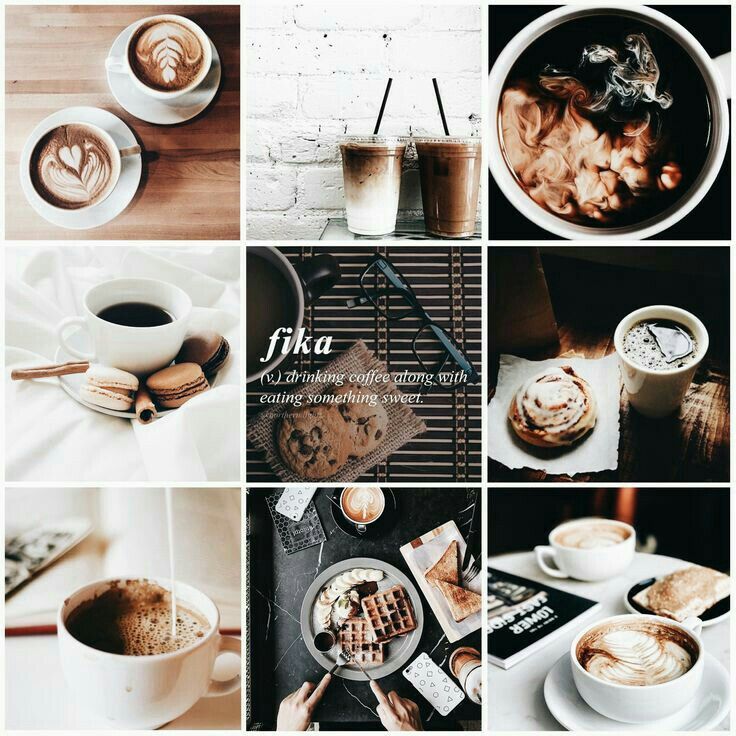
The image size is (736, 736). I want to click on partially and fully visible coffee cup handles, so click(116, 65), click(129, 151), click(66, 324), click(728, 63), click(232, 644).